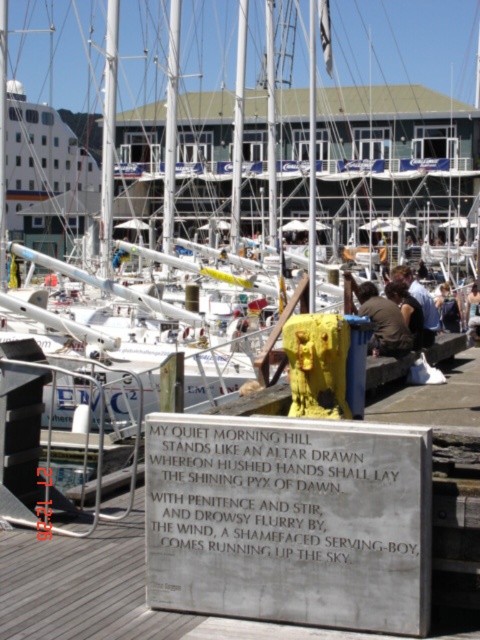
Question: Which point is closer to the camera taking this photo?

Choices:
 (A) (445, 292)
 (B) (395, 292)
 (C) (356, 612)

Answer: (C)

Question: Is silver polished stone plaque at center in front of brown fabric at center?

Choices:
 (A) yes
 (B) no

Answer: (A)

Question: Is light brown hair at center further to the viewer compared to dark brown leather jacket at center?

Choices:
 (A) yes
 (B) no

Answer: (A)

Question: Can you confirm if dark brown leather jacket at center is positioned to the left of dark blue shirt at center?

Choices:
 (A) yes
 (B) no

Answer: (A)

Question: Which object is positioned closest to the light brown hair at center?

Choices:
 (A) white glossy boat at center
 (B) silver polished stone plaque at center

Answer: (B)

Question: Which is farther from the white glossy boat at center?

Choices:
 (A) brown fabric at center
 (B) light brown hair at center
 (C) silver polished stone plaque at center
 (D) dark brown leather jacket at center

Answer: (B)